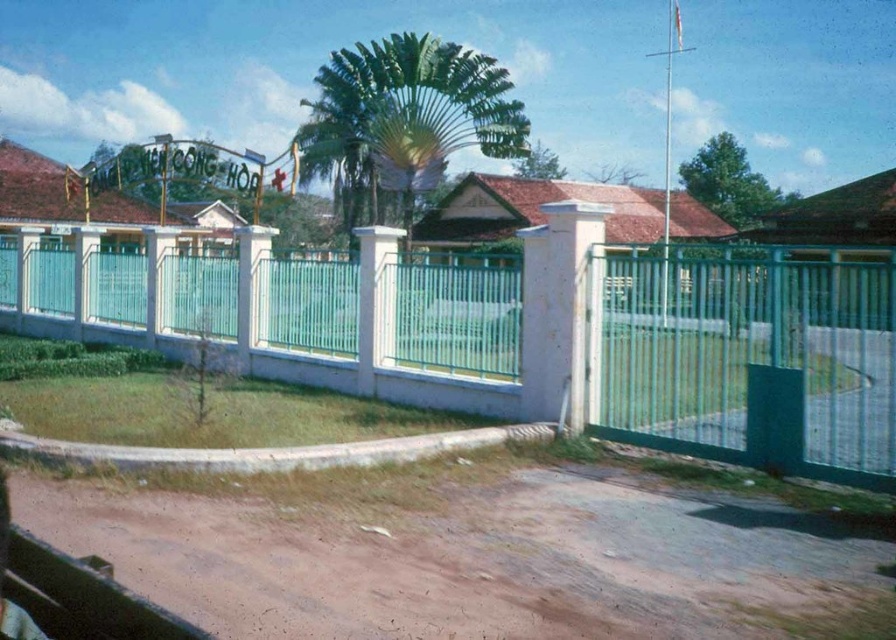
Is brown dirt track at lower center further to camera compared to green leafy palm tree at center?

That is False.

Can you confirm if brown dirt track at lower center is wider than green leafy palm tree at center?

Incorrect, brown dirt track at lower center's width does not surpass green leafy palm tree at center's.

Between point (791, 524) and point (421, 106), which one is positioned behind?

Positioned behind is point (421, 106).

Where is `brown dirt track at lower center`? This screenshot has width=896, height=640. brown dirt track at lower center is located at coordinates (466, 557).

Does point (713, 321) lie in front of point (388, 48)?

That is True.

Between teal metal fence at center and green leafy palm tree at center, which one is positioned higher?

green leafy palm tree at center is above.

Between point (7, 259) and point (339, 163), which one is positioned in front?

Point (7, 259) is in front.

Where is `teal metal fence at center`? The image size is (896, 640). teal metal fence at center is located at coordinates (517, 336).

Does teal metal fence at center have a greater width compared to brown dirt track at lower center?

Correct, the width of teal metal fence at center exceeds that of brown dirt track at lower center.

How much distance is there between teal metal fence at center and brown dirt track at lower center?

They are 25.74 feet apart.

Find the location of `teal metal fence at center`. teal metal fence at center is located at coordinates (517, 336).

Locate an element on the screen. This screenshot has height=640, width=896. teal metal fence at center is located at coordinates (517, 336).